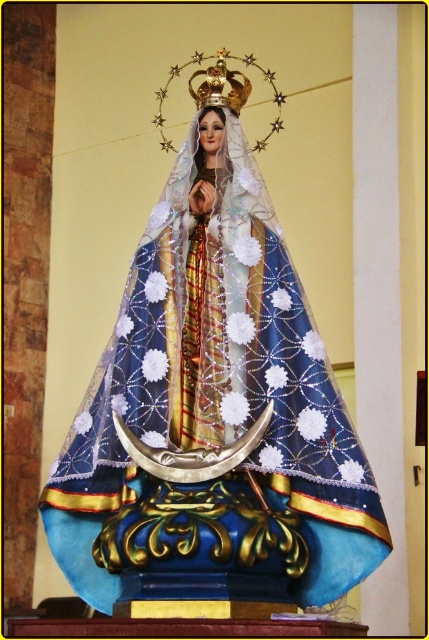
Which is above, blue fabric statue at center or gold metallic crown at upper center?

gold metallic crown at upper center is above.

Is point (277, 225) more distant than point (207, 100)?

No, (277, 225) is in front of (207, 100).

The image size is (429, 640). In order to click on blue fabric statue at center in this screenshot , I will do `click(217, 376)`.